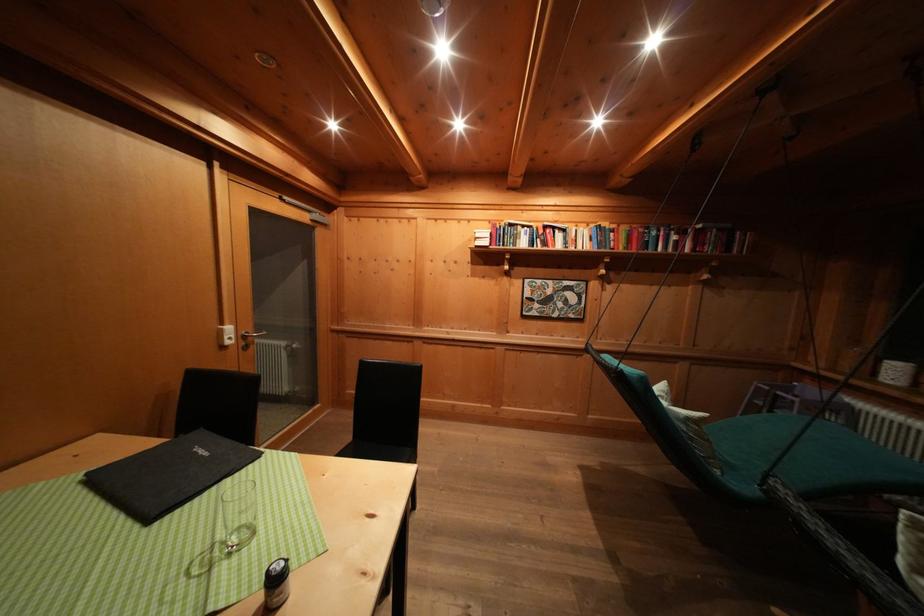
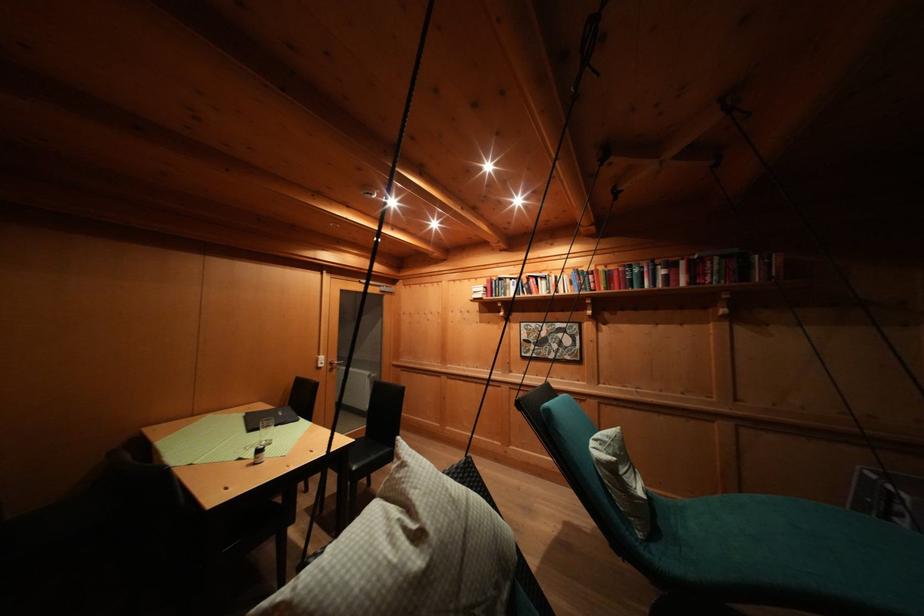
In the second image, find the point that corresponds to [236,333] in the first image.

(327, 362)